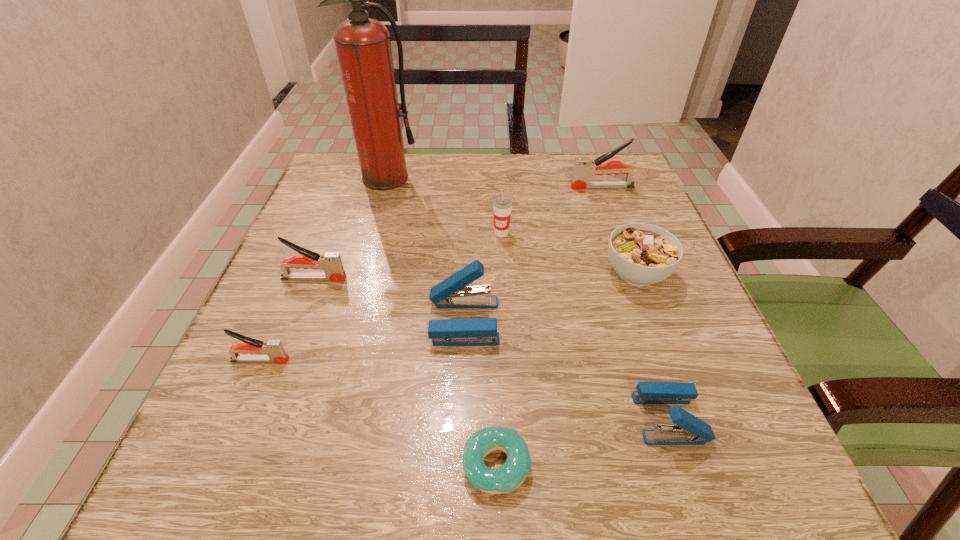
The width and height of the screenshot is (960, 540). I want to click on free spot between the shortest object and the soup bowl, so click(x=566, y=369).

Where is `object that is the fifth closest to the second farthest stapler`? The image size is (960, 540). object that is the fifth closest to the second farthest stapler is located at coordinates (508, 477).

Locate which object is the fifth closest to the farthest gray stapler. Please provide its 2D coordinates. Your answer should be formatted as a tuple, i.e. [(x, y)], where the tuple contains the x and y coordinates of a point satisfying the conditions above.

[(689, 430)]

You are a GUI agent. You are given a task and a screenshot of the screen. Output one action in this format:
    pyautogui.click(x=<x>, y=<y>)
    Task: Click on the fourth closest stapler relative to the smaller blue stapler
    
    Given the screenshot: What is the action you would take?
    pyautogui.click(x=584, y=168)

Image resolution: width=960 pixels, height=540 pixels. Identify the location of stapler that stands as the third closest to the fire extinguisher. (584, 168).

You are a GUI agent. You are given a task and a screenshot of the screen. Output one action in this format:
    pyautogui.click(x=<x>, y=<y>)
    Task: Click on the second closest gray stapler to the fire extinguisher
    The height and width of the screenshot is (540, 960).
    Given the screenshot: What is the action you would take?
    pyautogui.click(x=584, y=168)

Where is `gray stapler object that ranks as the closest to the farthest stapler`? The width and height of the screenshot is (960, 540). gray stapler object that ranks as the closest to the farthest stapler is located at coordinates (330, 262).

Where is `blank area in the image that satisfies the following two spatial constraints: 1. on the handle side of the doughnut; 2. on the right side of the second biggest gray stapler`? This screenshot has height=540, width=960. blank area in the image that satisfies the following two spatial constraints: 1. on the handle side of the doughnut; 2. on the right side of the second biggest gray stapler is located at coordinates (242, 465).

Find the location of a particular element. This screenshot has width=960, height=540. free region that satisfies the following two spatial constraints: 1. on the handle side of the second nearest gray stapler; 2. on the right side of the shortest object is located at coordinates (242, 465).

Identify the location of blank area in the image that satisfies the following two spatial constraints: 1. at the nozzle of the tallest object; 2. on the handle side of the nearest gray stapler. (334, 360).